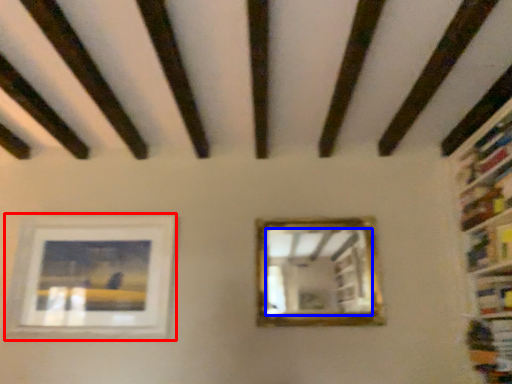
Question: Which object appears closest to the camera in this image, picture frame (highlighted by a red box) or mirror (highlighted by a blue box)?

Choices:
 (A) picture frame
 (B) mirror

Answer: (B)